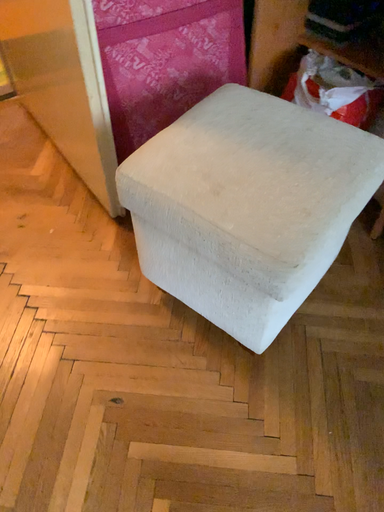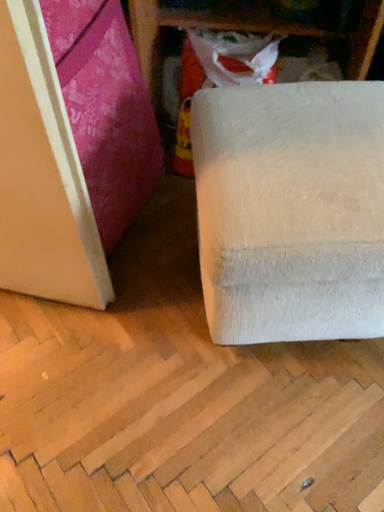
Question: How did the camera likely rotate when shooting the video?

Choices:
 (A) rotated right
 (B) rotated left

Answer: (A)